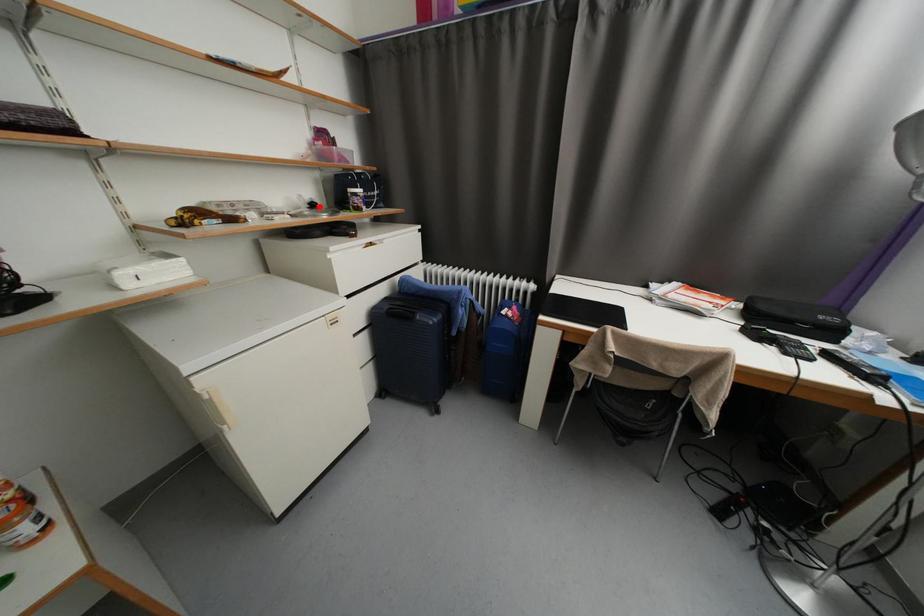
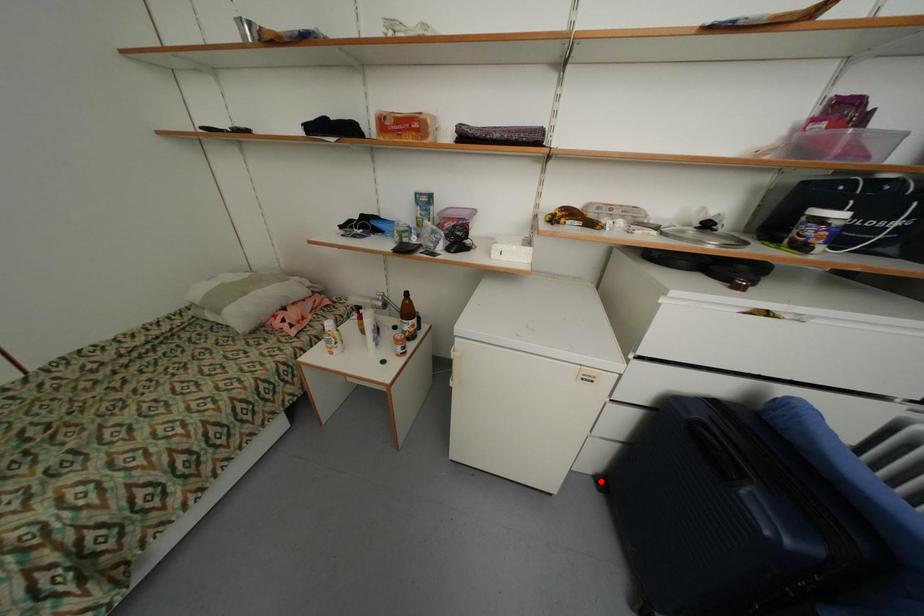
I am providing you with two images of the same scene from different viewpoints. A red point is marked on the first image and another point is marked on the second image. Does the point marked in image1 correspond to the same location as the one in image2?

No